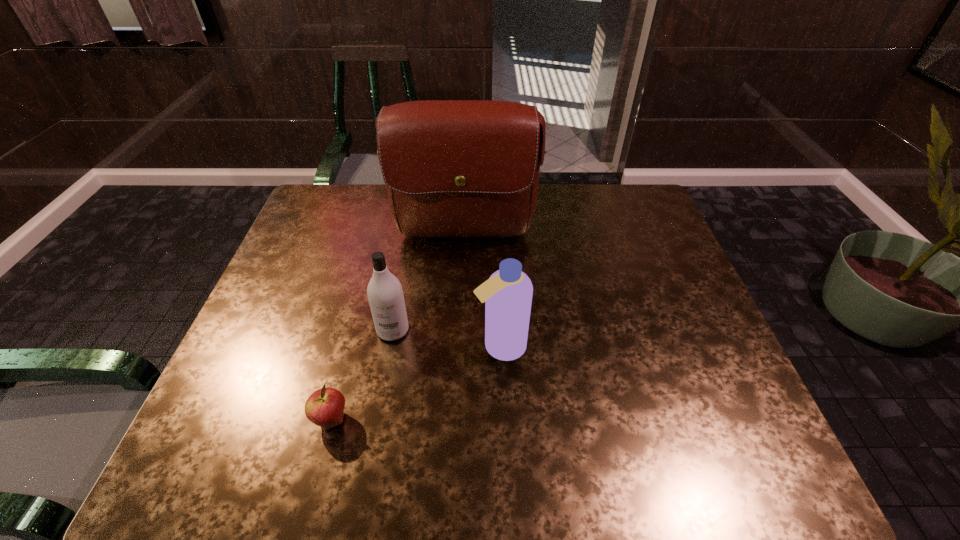
Identify the location of empty space that is in between the left shampoo and the leftmost object. (362, 375).

Where is `free space between the left shampoo and the right shampoo`? free space between the left shampoo and the right shampoo is located at coordinates (446, 338).

At what (x,y) coordinates should I click in order to perform the action: click on vacant space in between the tallest object and the left shampoo. Please return your answer as a coordinate pair (x, y). Looking at the image, I should click on (428, 284).

You are a GUI agent. You are given a task and a screenshot of the screen. Output one action in this format:
    pyautogui.click(x=<x>, y=<y>)
    Task: Click on the object that is the closest one to the satchel
    
    Given the screenshot: What is the action you would take?
    pyautogui.click(x=385, y=294)

Select which object is the closest to the apple. Please provide its 2D coordinates. Your answer should be formatted as a tuple, i.e. [(x, y)], where the tuple contains the x and y coordinates of a point satisfying the conditions above.

[(385, 294)]

The width and height of the screenshot is (960, 540). Identify the location of vacant area that satisfies the following two spatial constraints: 1. on the open flap of the right shampoo; 2. on the left side of the farthest object. (460, 346).

Image resolution: width=960 pixels, height=540 pixels. In order to click on free region that satisfies the following two spatial constraints: 1. on the front-facing side of the left shampoo; 2. on the right side of the right shampoo in this screenshot , I will do `click(390, 346)`.

Where is `vacant space that satisfies the following two spatial constraints: 1. on the front-facing side of the right shampoo; 2. on the left side of the left shampoo`? The width and height of the screenshot is (960, 540). vacant space that satisfies the following two spatial constraints: 1. on the front-facing side of the right shampoo; 2. on the left side of the left shampoo is located at coordinates (390, 346).

The height and width of the screenshot is (540, 960). I want to click on free region that satisfies the following two spatial constraints: 1. on the front-facing side of the left shampoo; 2. on the right side of the right shampoo, so pos(390,346).